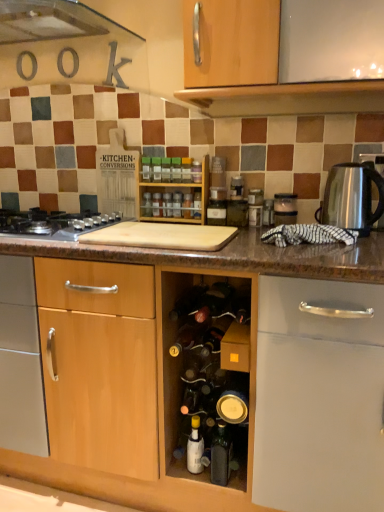
Question: Is green plastic spice at center, the 2th bottle from the top, outside silver metallic gas stove at left?

Choices:
 (A) no
 (B) yes

Answer: (B)

Question: From the image's perspective, is green plastic spice at center, arranged as the 10th bottle when ordered from the bottom, on top of silver metallic gas stove at left?

Choices:
 (A) no
 (B) yes

Answer: (B)

Question: Considering the relative sizes of green plastic spice at center, arranged as the 10th bottle when ordered from the bottom, and silver metallic gas stove at left in the image provided, is green plastic spice at center, arranged as the 10th bottle when ordered from the bottom, smaller than silver metallic gas stove at left?

Choices:
 (A) no
 (B) yes

Answer: (B)

Question: From a real-world perspective, is green plastic spice at center, arranged as the 10th bottle when ordered from the bottom, on top of silver metallic gas stove at left?

Choices:
 (A) yes
 (B) no

Answer: (A)

Question: Considering the relative sizes of green plastic spice at center, the 2th bottle from the top, and silver metallic gas stove at left in the image provided, is green plastic spice at center, the 2th bottle from the top, taller than silver metallic gas stove at left?

Choices:
 (A) yes
 (B) no

Answer: (A)

Question: Relative to translucent glass spice at center, arranged as the 7th bottle when ordered from the bottom, is satin silver toaster at upper right in front or behind?

Choices:
 (A) behind
 (B) front

Answer: (B)

Question: Considering the relative positions of satin silver toaster at upper right and translucent glass spice at center, arranged as the 7th bottle when ordered from the bottom, in the image provided, is satin silver toaster at upper right to the left or to the right of translucent glass spice at center, arranged as the 7th bottle when ordered from the bottom,?

Choices:
 (A) left
 (B) right

Answer: (B)

Question: Is satin silver toaster at upper right spatially inside translucent glass spice at center, arranged as the 7th bottle when ordered from the bottom, or outside of it?

Choices:
 (A) outside
 (B) inside

Answer: (A)

Question: From the image's perspective, is satin silver toaster at upper right above or below translucent glass spice at center, the fifth bottle viewed from the top?

Choices:
 (A) below
 (B) above

Answer: (A)

Question: From a real-world perspective, is dark glass wine bottle at center above or below translucent plastic spice at center, which is the first bottle in top-to-bottom order?

Choices:
 (A) below
 (B) above

Answer: (A)

Question: From the image's perspective, is dark glass wine bottle at center positioned above or below translucent plastic spice at center, which is the first bottle in top-to-bottom order?

Choices:
 (A) below
 (B) above

Answer: (A)

Question: In terms of width, does dark glass wine bottle at center look wider or thinner when compared to translucent plastic spice at center, which is the first bottle in top-to-bottom order?

Choices:
 (A) thin
 (B) wide

Answer: (B)

Question: Considering their positions, is dark glass wine bottle at center located in front of or behind translucent plastic spice at center, the 11th bottle from the bottom?

Choices:
 (A) behind
 (B) front

Answer: (B)

Question: Based on their positions, is translucent glass spice at center, acting as the 5th bottle starting from the bottom, located to the left or right of wooden spice rack at center?

Choices:
 (A) left
 (B) right

Answer: (B)

Question: In terms of height, does translucent glass spice at center, the 7th bottle viewed from the top, look taller or shorter compared to wooden spice rack at center?

Choices:
 (A) tall
 (B) short

Answer: (B)